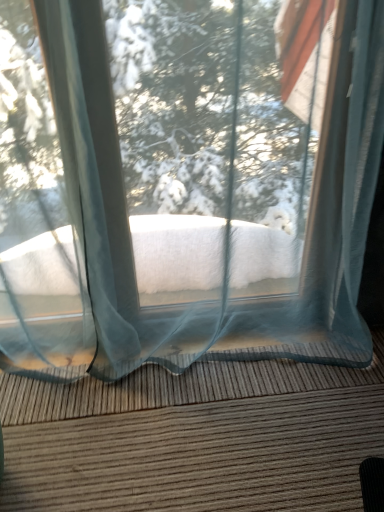
What do you see at coordinates (194, 437) in the screenshot? I see `wooden floor at lower center` at bounding box center [194, 437].

The height and width of the screenshot is (512, 384). Find the location of `wooden floor at lower center`. wooden floor at lower center is located at coordinates (194, 437).

Find the location of a particular element. wooden floor at lower center is located at coordinates (194, 437).